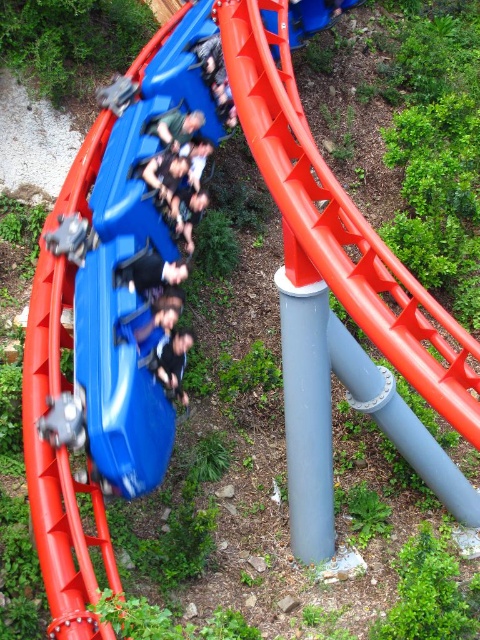
Who is lower down, smooth orange slide at center or black matte gloves at center?

black matte gloves at center is lower down.

Find the location of `smooth orange slide at center`. smooth orange slide at center is located at coordinates (340, 224).

Is smooth orange slide at center in front of matte black seats at center?

Yes, it is.

Who is shorter, smooth orange slide at center or matte black seats at center?

With less height is matte black seats at center.

Does point (284, 192) come behind point (171, 368)?

That is False.

The image size is (480, 640). In order to click on smooth orange slide at center in this screenshot , I will do `click(340, 224)`.

Can you confirm if matte black seats at center is positioned below black matte gloves at center?

Incorrect, matte black seats at center is not positioned below black matte gloves at center.

Does matte black seats at center have a lesser width compared to black matte gloves at center?

No, matte black seats at center is not thinner than black matte gloves at center.

The width and height of the screenshot is (480, 640). Find the location of `matte black seats at center`. matte black seats at center is located at coordinates (178, 173).

The image size is (480, 640). I want to click on matte black seats at center, so click(178, 173).